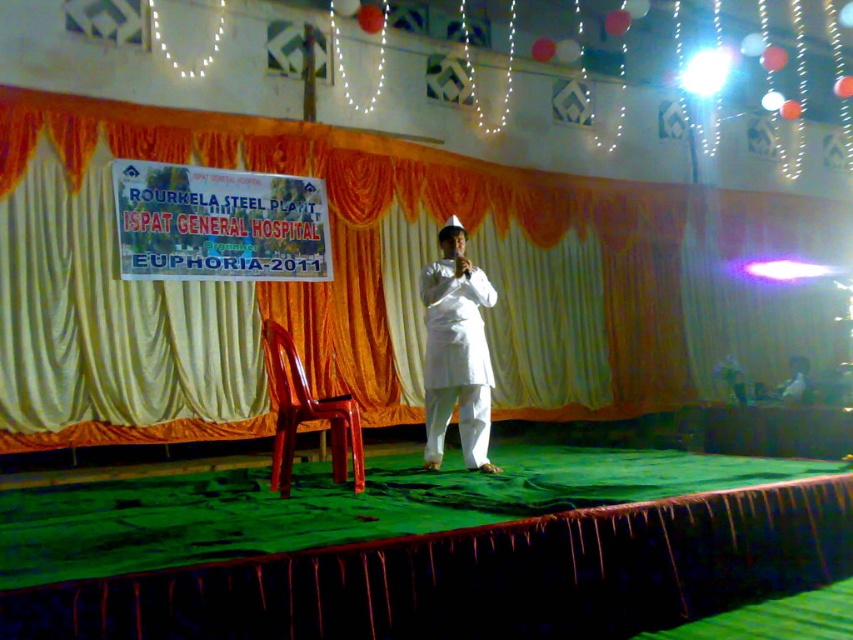
What is located at the point with coordinates [456,356] on the stage?

The point at [456,356] on the stage is occupied by the white cotton kurta at center.

You are an event planner trying to set up a spotlight for the performer. The spotlight needs to be placed above the white cotton kurta at center to highlight the performer. Is the orange fabric curtain at upper center in the way of placing the spotlight there?

The orange fabric curtain at upper center is above the white cotton kurta at center, so the curtain is in the way of placing the spotlight directly above the white cotton kurta at center.